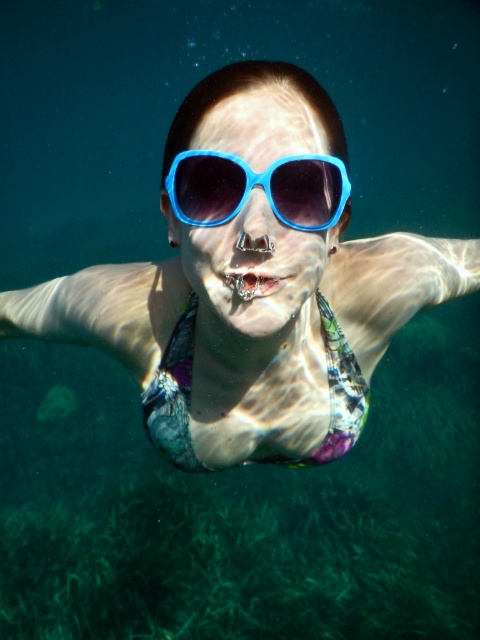
You are a photographer trying to capture the swimmer underwater. You notice two points in the image labeled point (336, 369) and point (228, 205). Which point is closer to the camera?

Point (228, 205) is closer to the camera than point (336, 369).